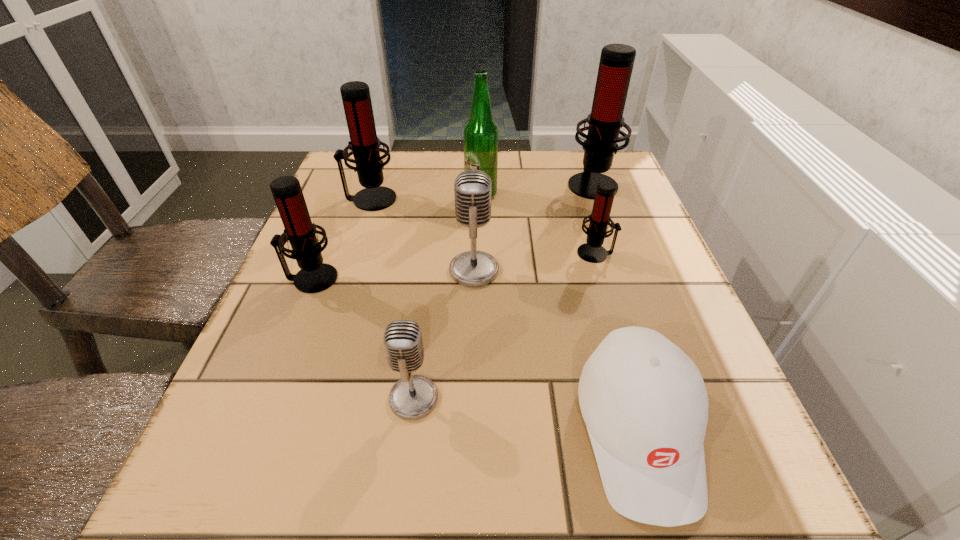
The image size is (960, 540). I want to click on vacant space that's between the white baseball cap and the green beer bottle, so click(x=560, y=314).

Image resolution: width=960 pixels, height=540 pixels. Identify the location of vacant space in between the second tallest microphone and the nearer gray microphone. (392, 299).

I want to click on unoccupied position between the left gray microphone and the farther gray microphone, so (444, 334).

You are a GUI agent. You are given a task and a screenshot of the screen. Output one action in this format:
    pyautogui.click(x=<x>, y=<y>)
    Task: Click on the free space between the green beer bottle and the shortest object
    
    Given the screenshot: What is the action you would take?
    pyautogui.click(x=560, y=314)

In order to click on vacant area that lies between the smallest red microphone and the nearest microphone in this screenshot , I will do `click(505, 326)`.

The height and width of the screenshot is (540, 960). Find the location of `blank region between the tallest microphone and the shortest object`. blank region between the tallest microphone and the shortest object is located at coordinates (615, 308).

The height and width of the screenshot is (540, 960). What are the coordinates of `object that is the sixth nearest to the left gray microphone` in the screenshot? It's located at (480, 132).

Locate an element on the screen. Image resolution: width=960 pixels, height=540 pixels. the closest object relative to the second biggest red microphone is located at coordinates (480, 132).

Locate an element on the screen. Image resolution: width=960 pixels, height=540 pixels. microphone identified as the fourth closest to the second nearest red microphone is located at coordinates (364, 144).

Point out which microphone is positioned as the fourth nearest to the white baseball cap. Please provide its 2D coordinates. Your answer should be formatted as a tuple, i.e. [(x, y)], where the tuple contains the x and y coordinates of a point satisfying the conditions above.

[(315, 276)]